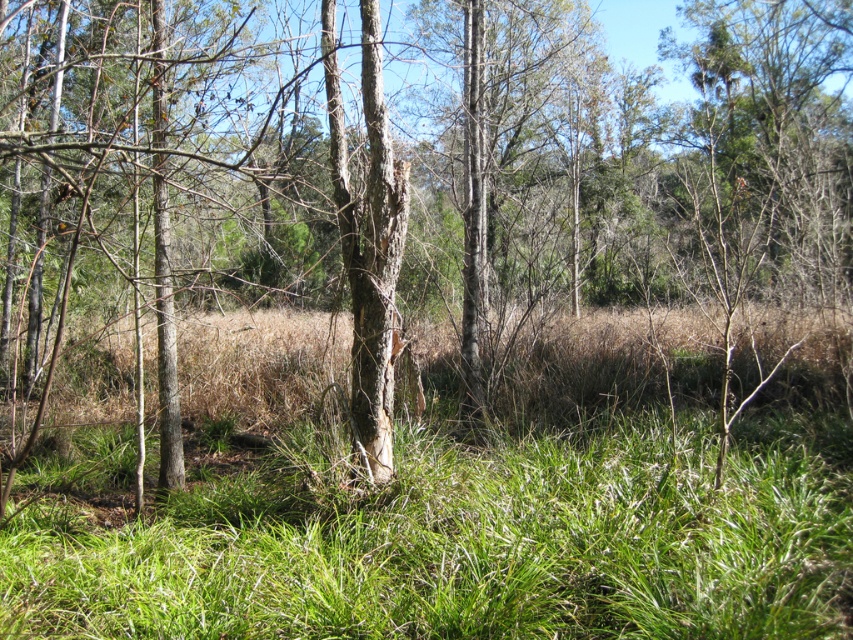
Question: Is green grass at center above smooth bark tree trunk at center?

Choices:
 (A) no
 (B) yes

Answer: (A)

Question: Is green grass at center to the right of smooth bark tree trunk at center from the viewer's perspective?

Choices:
 (A) yes
 (B) no

Answer: (A)

Question: Which point is farther to the camera?

Choices:
 (A) (679, 380)
 (B) (375, 417)

Answer: (A)

Question: Does green grass at center appear on the left side of smooth bark tree trunk at center?

Choices:
 (A) yes
 (B) no

Answer: (B)